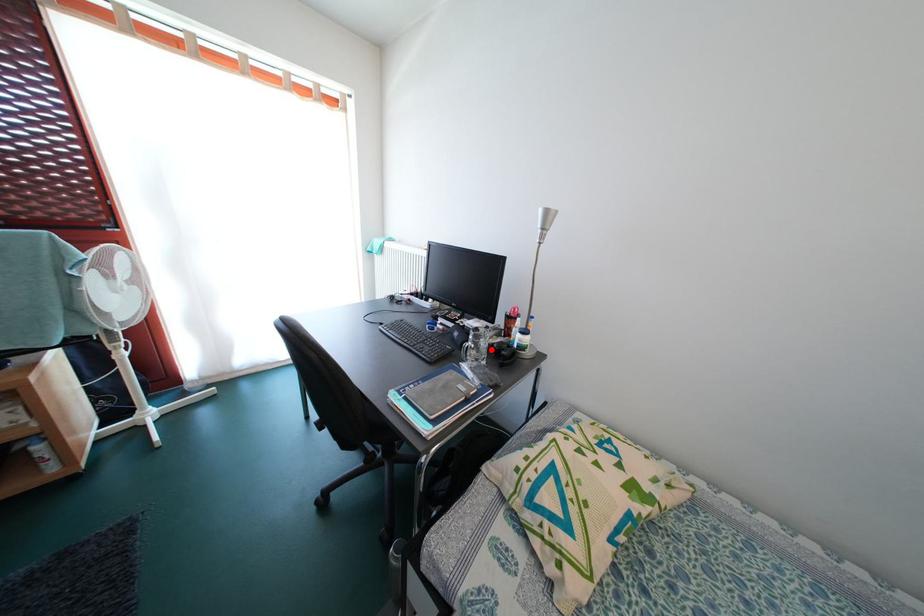
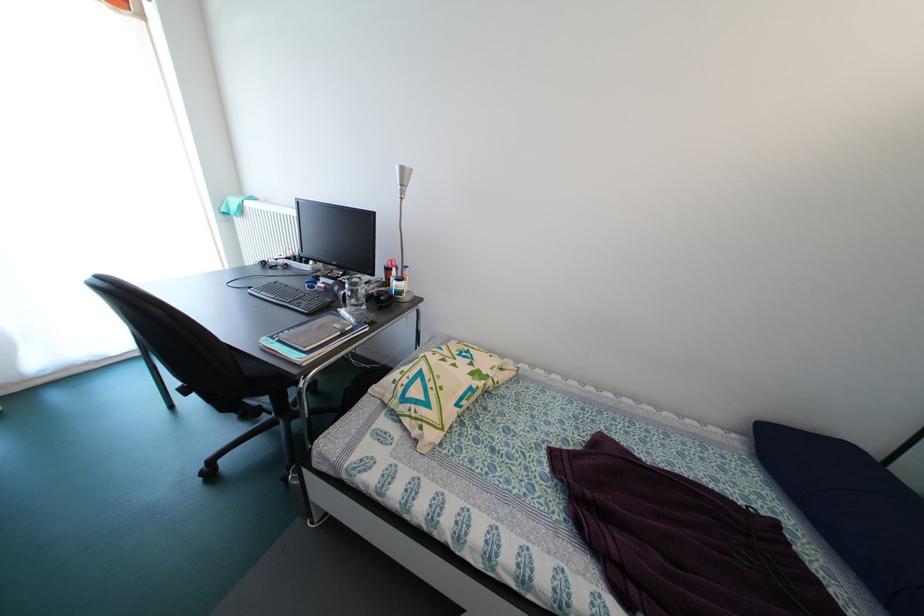
Find the pixel in the second image that matches the highlighted location in the first image.

(369, 297)